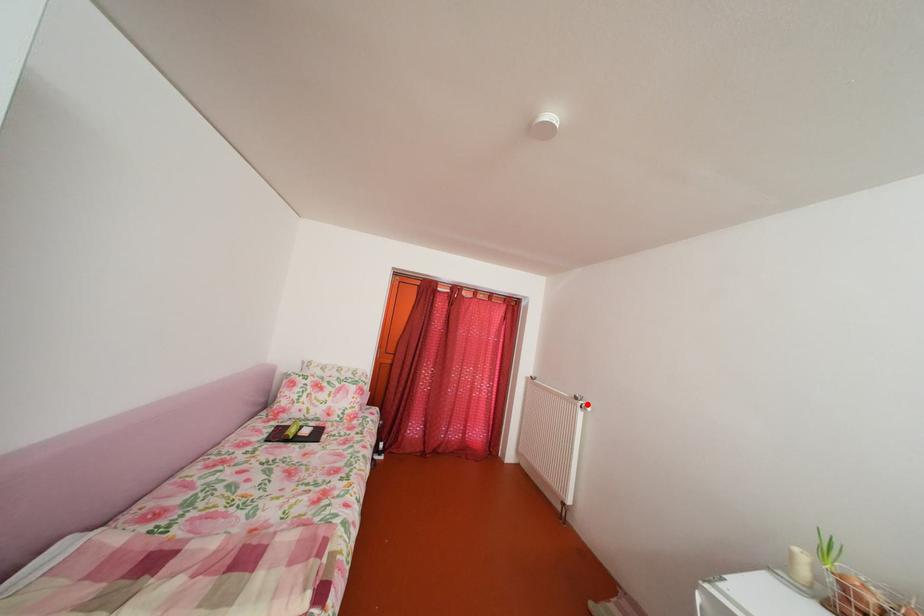
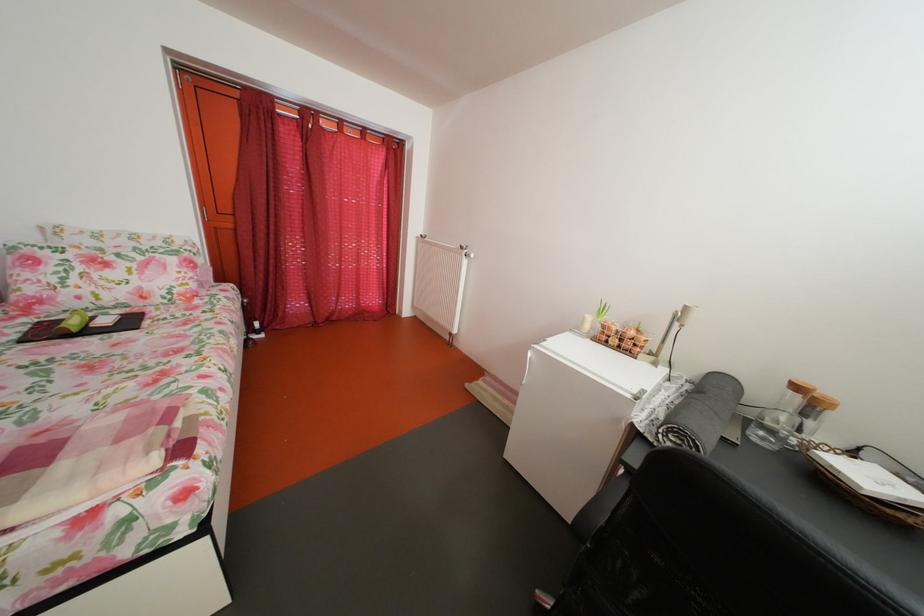
Question: A red point is marked in image1. In image2, is the corresponding 3D point closer to the camera or farther? Reply with the corresponding letter.

Choices:
 (A) The corresponding 3D point is closer.
 (B) The corresponding 3D point is farther.

Answer: (A)